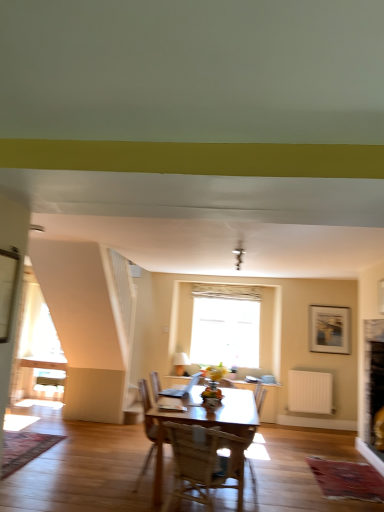
Image resolution: width=384 pixels, height=512 pixels. Identify the location of white plastic radiator at lower right. (310, 392).

Describe the element at coordinates (310, 392) in the screenshot. I see `white plastic radiator at lower right` at that location.

What do you see at coordinates (181, 362) in the screenshot? Image resolution: width=384 pixels, height=512 pixels. I see `white fabric lampshade at upper center` at bounding box center [181, 362].

In order to face white fabric lampshade at upper center, should I rotate leftwards or rightwards?

Rotate your view left by about 1.259°.

Measure the distance between point (330, 332) and camera.

Point (330, 332) is 6.70 meters from camera.

This screenshot has width=384, height=512. I want to click on white textured window at center, so click(x=225, y=325).

In order to face wooden chair at center, should I rotate leftwards or rightwards?

Rotate your view right by about 1.648°.

This screenshot has width=384, height=512. I want to click on white plastic radiator at lower right, so click(310, 392).

Does wooden framed picture at upper right turn towards white fabric lampshade at upper center?

No, wooden framed picture at upper right is not oriented towards white fabric lampshade at upper center.

How different are the orientations of wooden framed picture at upper right and white fabric lampshade at upper center in degrees?

0.624 degrees.

Is point (334, 317) less distant than point (173, 362)?

Yes, it is in front of point (173, 362).

Is wooden chair at center aimed at wooden framed picture at upper right?

Yes.

Can we say wooden chair at center lies outside wooden framed picture at upper right?

Absolutely, wooden chair at center is external to wooden framed picture at upper right.

Considering the relative sizes of wooden chair at center and wooden framed picture at upper right in the image provided, is wooden chair at center shorter than wooden framed picture at upper right?

Yes, wooden chair at center is shorter than wooden framed picture at upper right.

From a real-world perspective, which is physically below, wooden chair at center or wooden framed picture at upper right?

wooden chair at center.

Is white plastic radiator at lower right beside wooden framed picture at upper right?

They are not placed beside each other.

Is white plastic radiator at lower right facing towards wooden framed picture at upper right?

No, white plastic radiator at lower right does not turn towards wooden framed picture at upper right.

How different are the orientations of white plastic radiator at lower right and wooden framed picture at upper right in degrees?

There is a 1.56-degree angle between the facing directions of white plastic radiator at lower right and wooden framed picture at upper right.

What's the angular difference between white textured window at center and wooden chair at center's facing directions?

The angular difference between white textured window at center and wooden chair at center is 161 degrees.

Is white textured window at center outside of wooden chair at center?

That's correct, white textured window at center is outside of wooden chair at center.

From the picture: Is white textured window at center to the right of wooden chair at center from the viewer's perspective?

Indeed, white textured window at center is positioned on the right side of wooden chair at center.

Considering the sizes of wooden chair at center and white plastic radiator at lower right in the image, is wooden chair at center taller or shorter than white plastic radiator at lower right?

Clearly, wooden chair at center is taller compared to white plastic radiator at lower right.

From the image's perspective, is wooden chair at center positioned above or below white plastic radiator at lower right?

wooden chair at center is above white plastic radiator at lower right.

Can you see wooden chair at center touching white plastic radiator at lower right?

No, wooden chair at center is not making contact with white plastic radiator at lower right.

How many degrees apart are the facing directions of wooden chair at center and white plastic radiator at lower right?

162 degrees.

From the image's perspective, which object appears higher, white plastic radiator at lower right or wooden chair at center?

wooden chair at center appears higher in the image.

Measure the distance from white plastic radiator at lower right to wooden chair at center.

white plastic radiator at lower right is 3.77 meters from wooden chair at center.

Is white plastic radiator at lower right at the left side of wooden chair at center?

No, white plastic radiator at lower right is not to the left of wooden chair at center.

Considering the points (329, 395) and (218, 432), which point is in front, point (329, 395) or point (218, 432)?

The point (218, 432) is more forward.

Can you confirm if white fabric lampshade at upper center is bigger than wooden framed picture at upper right?

Indeed, white fabric lampshade at upper center has a larger size compared to wooden framed picture at upper right.

Does point (176, 354) come farther from viewer compared to point (337, 344)?

Yes, it is.

Based on the photo, would you consider white fabric lampshade at upper center to be distant from wooden framed picture at upper right?

white fabric lampshade at upper center is positioned a significant distance from wooden framed picture at upper right.

At what (x,y) coordinates should I click in order to perform the action: click on picture frame on the right of white fabric lampshade at upper center. Please return your answer as a coordinate pair (x, y). Image resolution: width=384 pixels, height=512 pixels. Looking at the image, I should click on (329, 329).

The image size is (384, 512). I want to click on chair below the wooden framed picture at upper right (from the image's perspective), so click(x=205, y=462).

Estimate the real-world distances between objects in this image. Which object is closer to white plastic radiator at lower right, white textured window at center or wooden chair at center?

The object closer to white plastic radiator at lower right is white textured window at center.

Based on their spatial positions, is white plastic radiator at lower right or white textured window at center further from wooden chair at center?

Among the two, white textured window at center is located further to wooden chair at center.

When comparing their distances from wooden framed picture at upper right, does white plastic radiator at lower right or wooden chair at center seem further?

wooden chair at center is positioned further to the anchor wooden framed picture at upper right.

When comparing their distances from wooden chair at center, does white fabric lampshade at upper center or wooden framed picture at upper right seem further?

white fabric lampshade at upper center lies further to wooden chair at center than the other object.

From the image, which object appears to be nearer to white textured window at center, white fabric lampshade at upper center or white plastic radiator at lower right?

Based on the image, white fabric lampshade at upper center appears to be nearer to white textured window at center.

From the image, which object appears to be nearer to white fabric lampshade at upper center, white plastic radiator at lower right or wooden framed picture at upper right?

white plastic radiator at lower right.

Which object lies further to the anchor point white textured window at center, wooden framed picture at upper right or white fabric lampshade at upper center?

The object further to white textured window at center is wooden framed picture at upper right.

Looking at the image, which one is located further to white fabric lampshade at upper center, wooden framed picture at upper right or white plastic radiator at lower right?

wooden framed picture at upper right.

In order to click on window situated between white fabric lampshade at upper center and white plastic radiator at lower right from left to right in this screenshot , I will do `click(225, 325)`.

The height and width of the screenshot is (512, 384). In order to click on radiator between white fabric lampshade at upper center and wooden framed picture at upper right in the horizontal direction in this screenshot , I will do `click(310, 392)`.

Locate an element on the screen. radiator located between wooden chair at center and white fabric lampshade at upper center in the depth direction is located at coordinates (310, 392).

The width and height of the screenshot is (384, 512). What are the coordinates of `radiator between white textured window at center and wooden framed picture at upper right from left to right` in the screenshot? It's located at (310, 392).